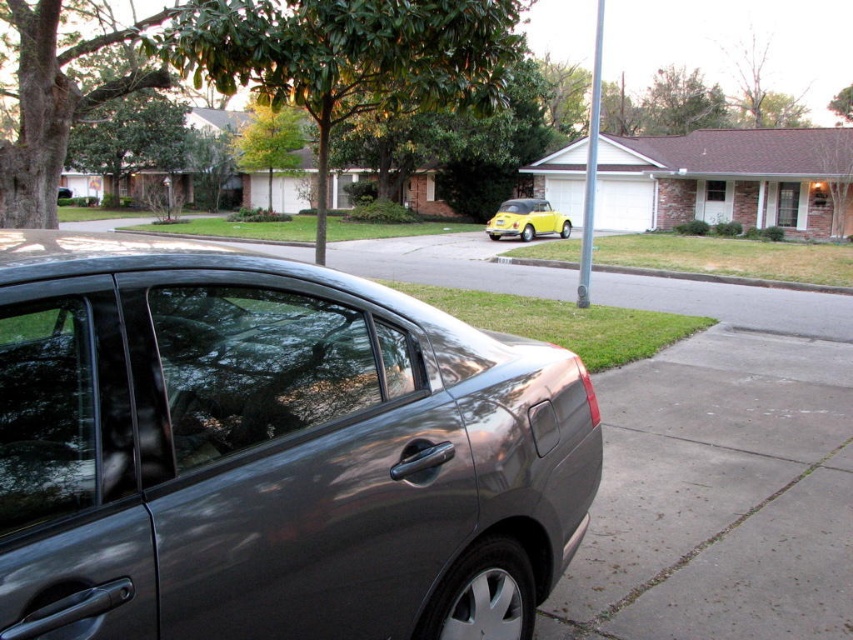
Who is more forward, (635, 272) or (515, 218)?

Point (635, 272) is in front.

Is gray concrete curb at lower center shorter than yellow matte car at center?

Indeed, gray concrete curb at lower center has a lesser height compared to yellow matte car at center.

Is point (506, 262) farther from camera compared to point (502, 220)?

No, (506, 262) is closer to viewer.

Identify the location of gray concrete curb at lower center. The image size is (853, 640). (722, 278).

Consider the image. Does satin metallic sedan at center appear under gray concrete pavement at lower right?

No.

Can you confirm if satin metallic sedan at center is smaller than gray concrete pavement at lower right?

Actually, satin metallic sedan at center might be larger than gray concrete pavement at lower right.

Does point (196, 305) come in front of point (747, 625)?

Yes.

At what (x,y) coordinates should I click in order to perform the action: click on satin metallic sedan at center. Please return your answer as a coordinate pair (x, y). Looking at the image, I should click on (271, 451).

Does gray concrete pavement at lower right appear on the left side of yellow matte car at center?

Correct, you'll find gray concrete pavement at lower right to the left of yellow matte car at center.

You are a GUI agent. You are given a task and a screenshot of the screen. Output one action in this format:
    pyautogui.click(x=<x>, y=<y>)
    Task: Click on the gray concrete pavement at lower right
    The width and height of the screenshot is (853, 640).
    Given the screenshot: What is the action you would take?
    pyautogui.click(x=718, y=497)

Is point (764, 506) positioned after point (521, 212)?

No, (764, 506) is in front of (521, 212).

At what (x,y) coordinates should I click in order to perform the action: click on gray concrete pavement at lower right. Please return your answer as a coordinate pair (x, y). The image size is (853, 640). Looking at the image, I should click on coord(718,497).